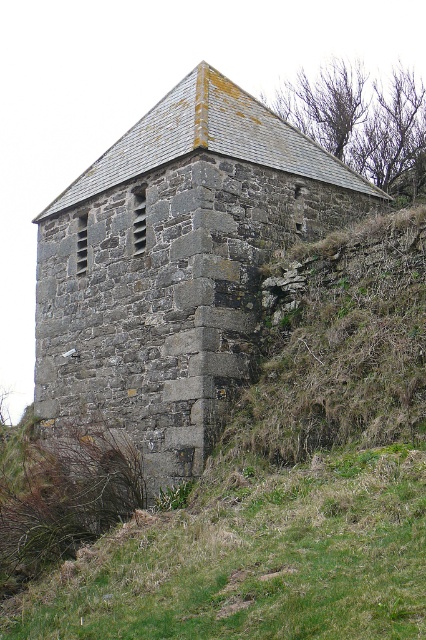
Between point (121, 221) and point (389, 609), which one is positioned in front?

Point (389, 609)

Is gray stone tower at center in front of green grassy at lower center?

No, it is not.

Where is `gray stone tower at center`? gray stone tower at center is located at coordinates (175, 266).